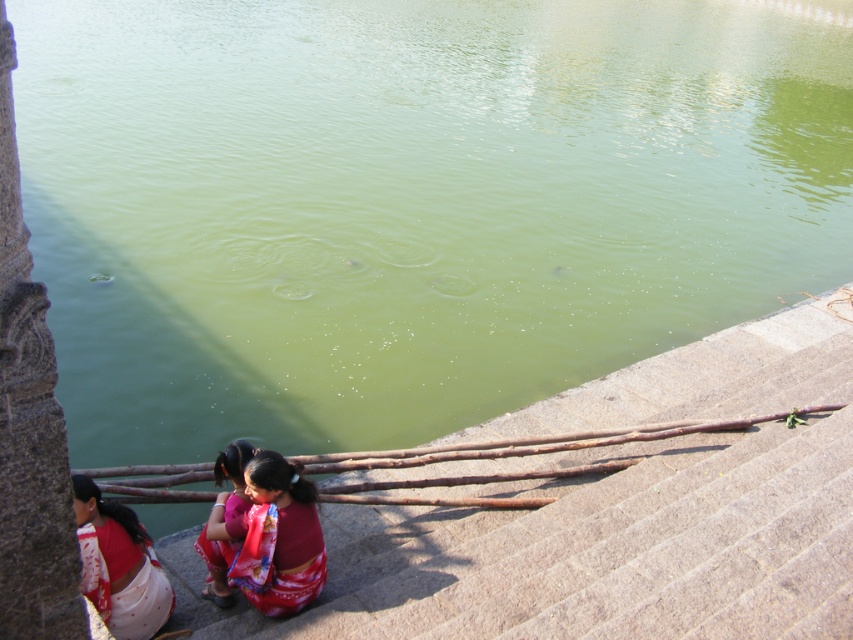
Question: Among these points, which one is nearest to the camera?

Choices:
 (A) (202, 556)
 (B) (88, 561)
 (C) (244, 472)

Answer: (B)

Question: Based on their relative distances, which object is nearer to the white cotton saree at lower left?

Choices:
 (A) red satin sari at lower center
 (B) red satin saree at lower center

Answer: (B)

Question: Is red satin sari at lower center wider than white cotton saree at lower left?

Choices:
 (A) yes
 (B) no

Answer: (A)

Question: Is white cotton saree at lower left further to camera compared to red satin saree at lower center?

Choices:
 (A) no
 (B) yes

Answer: (A)

Question: Can you confirm if red satin sari at lower center is bigger than red satin saree at lower center?

Choices:
 (A) no
 (B) yes

Answer: (A)

Question: Which is nearer to the red satin saree at lower center?

Choices:
 (A) red satin sari at lower center
 (B) white cotton saree at lower left

Answer: (A)